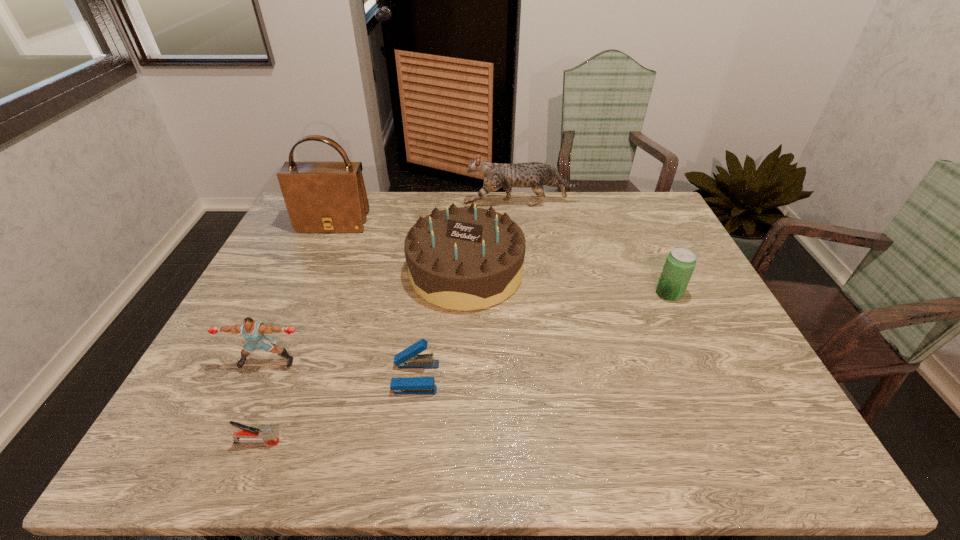
Locate an element on the screen. Image resolution: width=960 pixels, height=540 pixels. vacant space that satisfies the following two spatial constraints: 1. on the front-facing side of the farther stapler; 2. on the right side of the puncher is located at coordinates (260, 377).

The image size is (960, 540). Identify the location of vacant area that satisfies the following two spatial constraints: 1. on the front flap of the right stapler; 2. on the left side of the second farthest object. (266, 377).

I want to click on free space that satisfies the following two spatial constraints: 1. on the front flap of the farther stapler; 2. on the left side of the tallest object, so click(x=266, y=377).

You are a GUI agent. You are given a task and a screenshot of the screen. Output one action in this format:
    pyautogui.click(x=<x>, y=<y>)
    Task: Click on the free space in the image that satisfies the following two spatial constraints: 1. on the face of the cat; 2. on the back side of the rightmost object
    Image resolution: width=960 pixels, height=540 pixels.
    Given the screenshot: What is the action you would take?
    pyautogui.click(x=534, y=294)

Locate an element on the screen. This screenshot has width=960, height=540. blank space that satisfies the following two spatial constraints: 1. on the face of the cat; 2. on the front-facing side of the puncher is located at coordinates (542, 362).